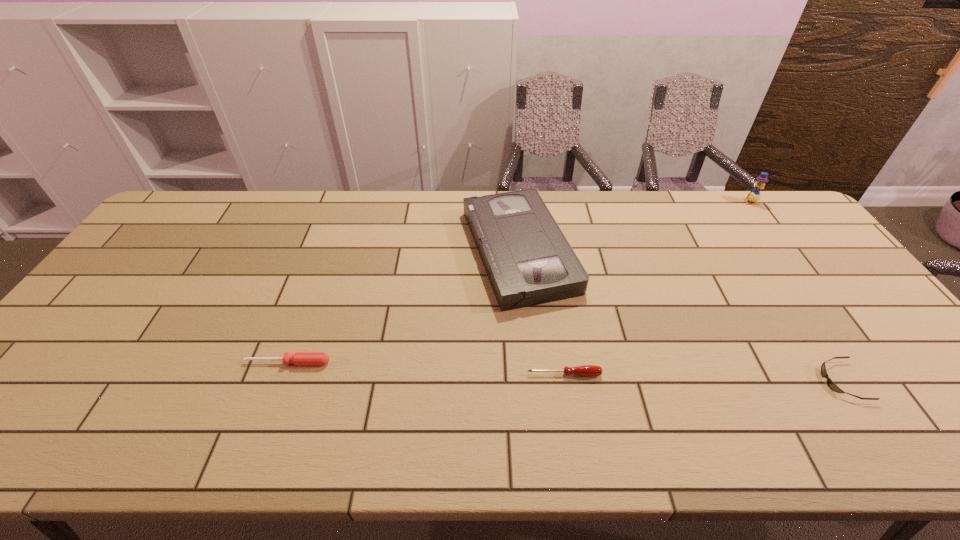
You are a GUI agent. You are given a task and a screenshot of the screen. Output one action in this format:
    pyautogui.click(x=<x>, y=<y>)
    Task: Click on the tallest object
    The image size is (960, 540).
    Given the screenshot: What is the action you would take?
    pyautogui.click(x=754, y=195)

You are a GUI agent. You are given a task and a screenshot of the screen. Output one action in this format:
    pyautogui.click(x=<x>, y=<y>)
    Task: Click on the duckling
    The width and height of the screenshot is (960, 540).
    Given the screenshot: What is the action you would take?
    pyautogui.click(x=754, y=195)

Identify the location of videotape. The height and width of the screenshot is (540, 960). 528,260.

Image resolution: width=960 pixels, height=540 pixels. I want to click on the farther screwdriver, so click(x=299, y=358).

You are a GUI agent. You are given a task and a screenshot of the screen. Output one action in this format:
    pyautogui.click(x=<x>, y=<y>)
    Task: Click on the left screwdriver
    
    Given the screenshot: What is the action you would take?
    pyautogui.click(x=299, y=358)

Image resolution: width=960 pixels, height=540 pixels. Find the location of `the right screwdriver`. the right screwdriver is located at coordinates (587, 370).

You are a GUI agent. You are given a task and a screenshot of the screen. Output one action in this format:
    pyautogui.click(x=<x>, y=<y>)
    Task: Click on the shortest object
    
    Given the screenshot: What is the action you would take?
    pyautogui.click(x=830, y=383)

Where is `the fourth object from left to right`? The width and height of the screenshot is (960, 540). the fourth object from left to right is located at coordinates (830, 383).

Where is `free spot located on the face of the duckling, where the monocle is placed`? The height and width of the screenshot is (540, 960). free spot located on the face of the duckling, where the monocle is placed is located at coordinates (783, 247).

You are a GUI agent. You are given a task and a screenshot of the screen. Output one action in this format:
    pyautogui.click(x=<x>, y=<y>)
    Task: Click on the vacant space located on the front of the videotape
    The image size is (960, 540).
    Given the screenshot: What is the action you would take?
    pyautogui.click(x=528, y=345)